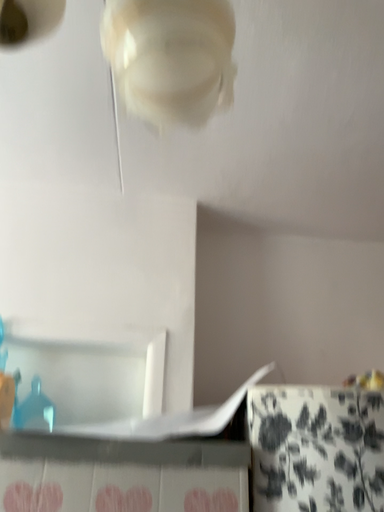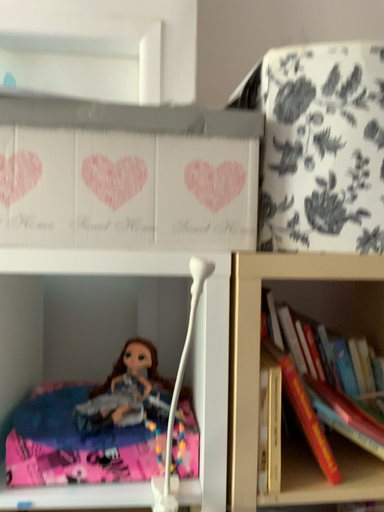
Question: Which way did the camera rotate in the video?

Choices:
 (A) rotated downward
 (B) rotated upward

Answer: (A)